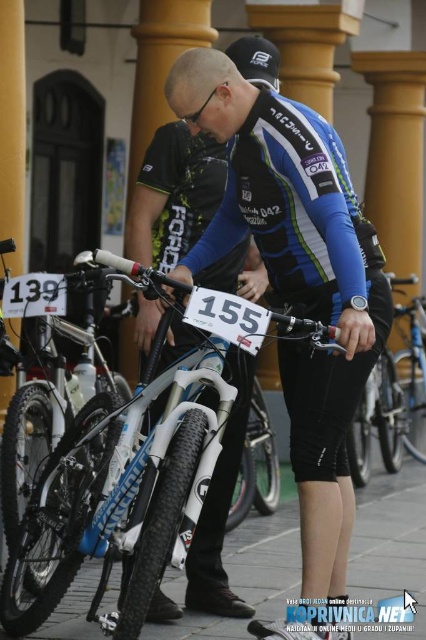
Question: Can you confirm if blue/white jersey at center is positioned above black matte bicycle helmet at upper center?

Choices:
 (A) yes
 (B) no

Answer: (B)

Question: Which of the following is the closest to the observer?

Choices:
 (A) blue/white jersey at center
 (B) shiny silver bike at center
 (C) black matte bicycle helmet at upper center

Answer: (A)

Question: Can you confirm if blue/white jersey at center is smaller than white matte bicycle at center?

Choices:
 (A) yes
 (B) no

Answer: (B)

Question: Considering the relative positions of blue/white jersey at center and white matte bicycle at center in the image provided, where is blue/white jersey at center located with respect to white matte bicycle at center?

Choices:
 (A) right
 (B) left

Answer: (A)

Question: Which object is the farthest from the blue/white jersey at center?

Choices:
 (A) white matte bicycle at center
 (B) black matte bicycle helmet at upper center

Answer: (B)

Question: Which object is closer to the camera taking this photo?

Choices:
 (A) white matte bicycle at center
 (B) black matte bicycle helmet at upper center
 (C) blue/white jersey at center

Answer: (A)